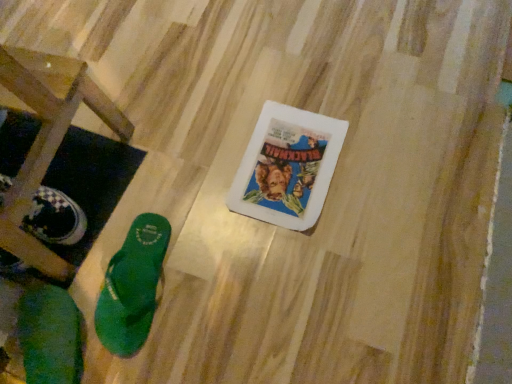
Question: From the image's perspective, does green fabric flip-flop at lower left, the second footwear viewed from the right, appear higher than green rubber flip-flop at lower left, acting as the 2th footwear starting from the left?

Choices:
 (A) yes
 (B) no

Answer: (B)

Question: Would you say green fabric flip-flop at lower left, the second footwear viewed from the right, is a long distance from green rubber flip-flop at lower left, acting as the 2th footwear starting from the left?

Choices:
 (A) no
 (B) yes

Answer: (A)

Question: Can you confirm if green fabric flip-flop at lower left, the second footwear viewed from the right, is wider than green rubber flip-flop at lower left, acting as the 2th footwear starting from the left?

Choices:
 (A) no
 (B) yes

Answer: (B)

Question: Is green fabric flip-flop at lower left, positioned as the first footwear in left-to-right order, shorter than green rubber flip-flop at lower left, acting as the 2th footwear starting from the left?

Choices:
 (A) yes
 (B) no

Answer: (B)

Question: Can you confirm if green fabric flip-flop at lower left, the second footwear viewed from the right, is taller than green rubber flip-flop at lower left, acting as the 2th footwear starting from the left?

Choices:
 (A) no
 (B) yes

Answer: (B)

Question: From the image's perspective, is green fabric flip-flop at lower left, positioned as the first footwear in left-to-right order, beneath green rubber flip-flop at lower left, which is counted as the first footwear, starting from the right?

Choices:
 (A) no
 (B) yes

Answer: (B)

Question: From the image's perspective, is wooden stool at lower left on green rubber flip-flop at lower left, which is counted as the first footwear, starting from the right?

Choices:
 (A) no
 (B) yes

Answer: (B)

Question: Is wooden stool at lower left touching green rubber flip-flop at lower left, which is counted as the first footwear, starting from the right?

Choices:
 (A) no
 (B) yes

Answer: (A)

Question: Is wooden stool at lower left at the right side of green rubber flip-flop at lower left, acting as the 2th footwear starting from the left?

Choices:
 (A) yes
 (B) no

Answer: (B)

Question: From the image's perspective, is wooden stool at lower left below green rubber flip-flop at lower left, which is counted as the first footwear, starting from the right?

Choices:
 (A) yes
 (B) no

Answer: (B)

Question: Is the depth of wooden stool at lower left greater than that of green rubber flip-flop at lower left, acting as the 2th footwear starting from the left?

Choices:
 (A) yes
 (B) no

Answer: (B)

Question: Considering the relative sizes of wooden stool at lower left and green rubber flip-flop at lower left, which is counted as the first footwear, starting from the right, in the image provided, is wooden stool at lower left bigger than green rubber flip-flop at lower left, which is counted as the first footwear, starting from the right,?

Choices:
 (A) no
 (B) yes

Answer: (B)

Question: Does green rubber flip-flop at lower left, acting as the 2th footwear starting from the left, have a lesser width compared to green fabric flip-flop at lower left, the second footwear viewed from the right?

Choices:
 (A) yes
 (B) no

Answer: (A)